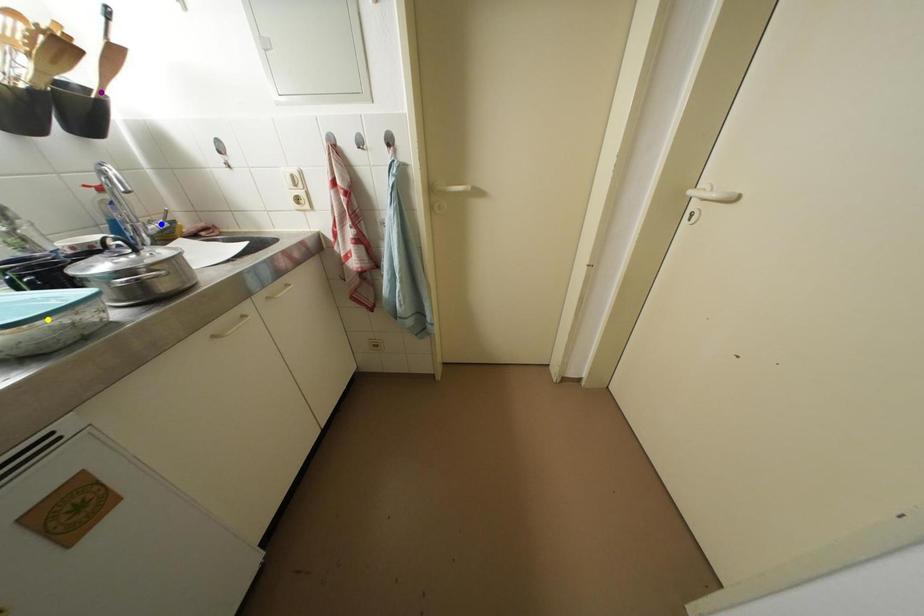
Order these from farthest to nearest:
yellow point | blue point | purple point

blue point < purple point < yellow point